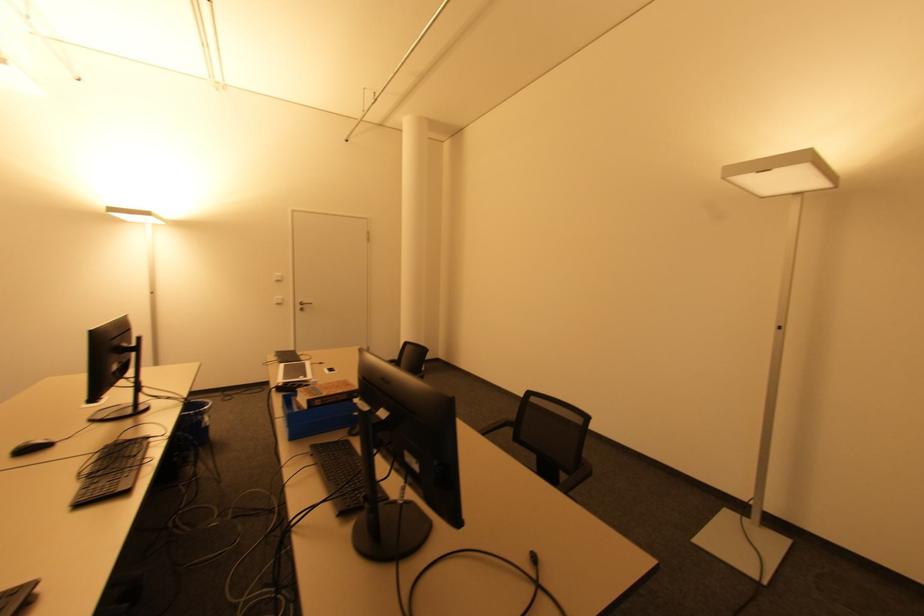
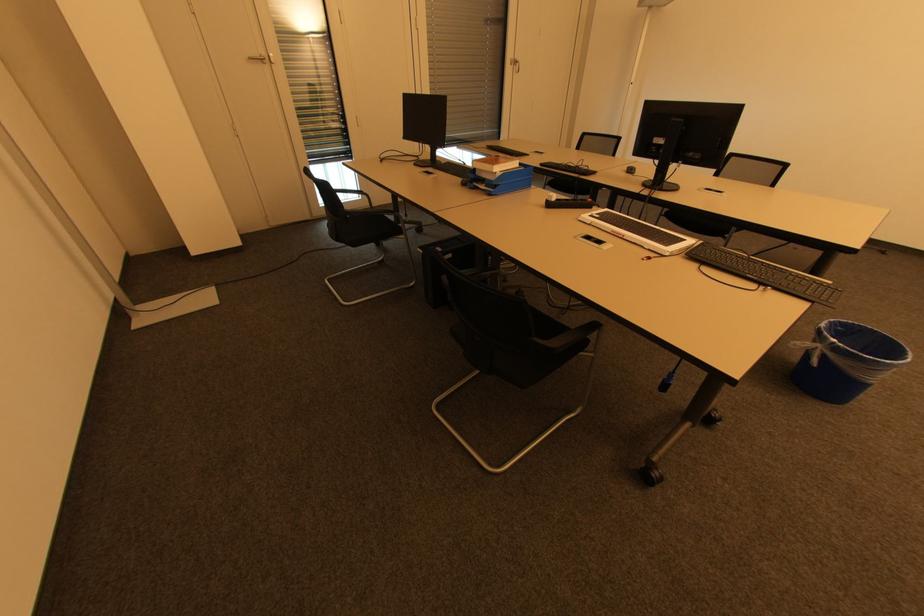
The point at (209, 407) is marked in the first image. Where is the corresponding point in the second image?

(835, 341)